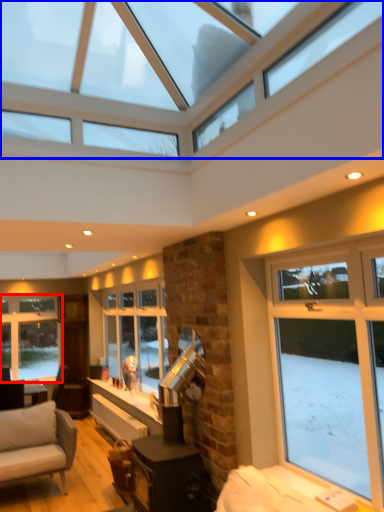
Question: Which of the following is the closest to the observer, window (highlighted by a red box) or window (highlighted by a blue box)?

Choices:
 (A) window
 (B) window

Answer: (B)